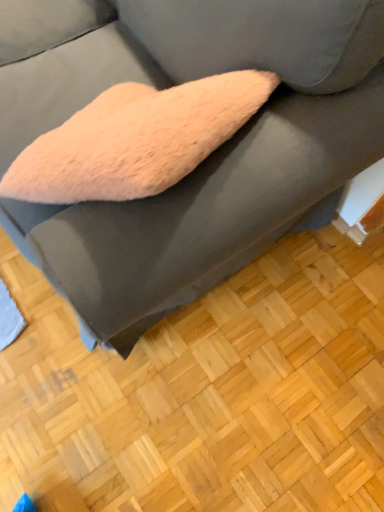
Question: Is fuzzy pink pillow at center bigger or smaller than light brown wood flooring at lower center?

Choices:
 (A) big
 (B) small

Answer: (A)

Question: From the image's perspective, relative to light brown wood flooring at lower center, is fuzzy pink pillow at center above or below?

Choices:
 (A) below
 (B) above

Answer: (B)

Question: Looking at their shapes, would you say fuzzy pink pillow at center is wider or thinner than light brown wood flooring at lower center?

Choices:
 (A) wide
 (B) thin

Answer: (B)

Question: Is light brown wood flooring at lower center inside the boundaries of fuzzy pink pillow at center, or outside?

Choices:
 (A) outside
 (B) inside

Answer: (A)

Question: In terms of height, does light brown wood flooring at lower center look taller or shorter compared to fuzzy pink pillow at center?

Choices:
 (A) tall
 (B) short

Answer: (B)

Question: From the image's perspective, is light brown wood flooring at lower center positioned above or below fuzzy pink pillow at center?

Choices:
 (A) below
 (B) above

Answer: (A)

Question: Is light brown wood flooring at lower center in front of or behind fuzzy pink pillow at center in the image?

Choices:
 (A) front
 (B) behind

Answer: (B)